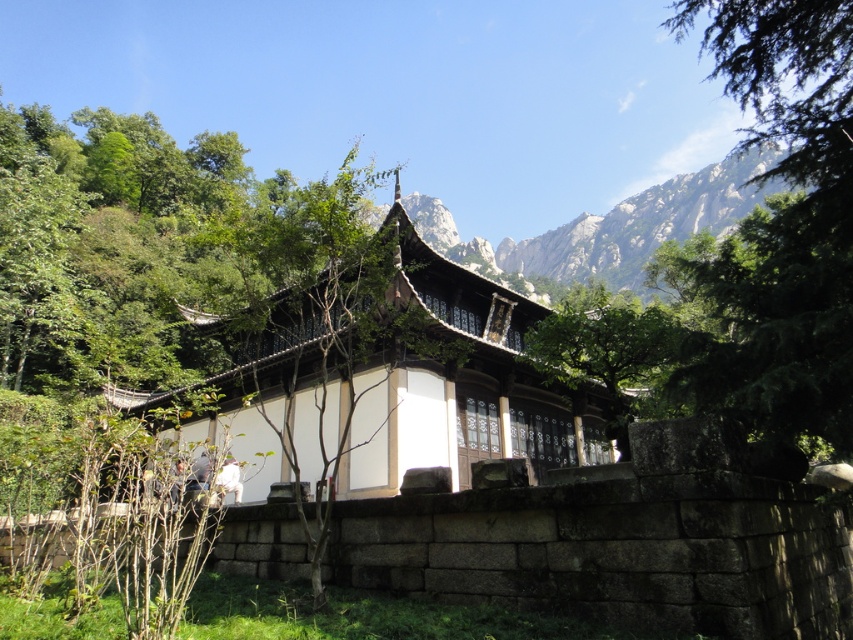
You are standing in front of the traditional East Asian building and want to take a photo that includes both the green leafy tree at upper right and the gray rocky mountain at upper center. Which object should you position closer to the edge of the frame to ensure both are visible?

You should position the gray rocky mountain at upper center closer to the edge of the frame because the green leafy tree at upper right is closer to the viewer, so it will naturally appear larger and occupy more space in the photo. By moving the mountain toward the edge, you can balance the composition and ensure both elements are visible.

You are standing in front of the traditional East Asian building and notice the green leafy tree at upper right and the gray rocky mountain at upper center. Which object appears smaller in the image?

The green leafy tree at upper right appears smaller compared to the gray rocky mountain at upper center.

You are an architect designing a new garden layout and need to place a small statue between the green leafy tree at upper right and the gray rocky mountain at upper center. Based on their widths, which object should the statue be closer to?

The green leafy tree at upper right has a smaller width than the gray rocky mountain at upper center, so the statue should be placed closer to the gray rocky mountain at upper center to maintain visual balance.